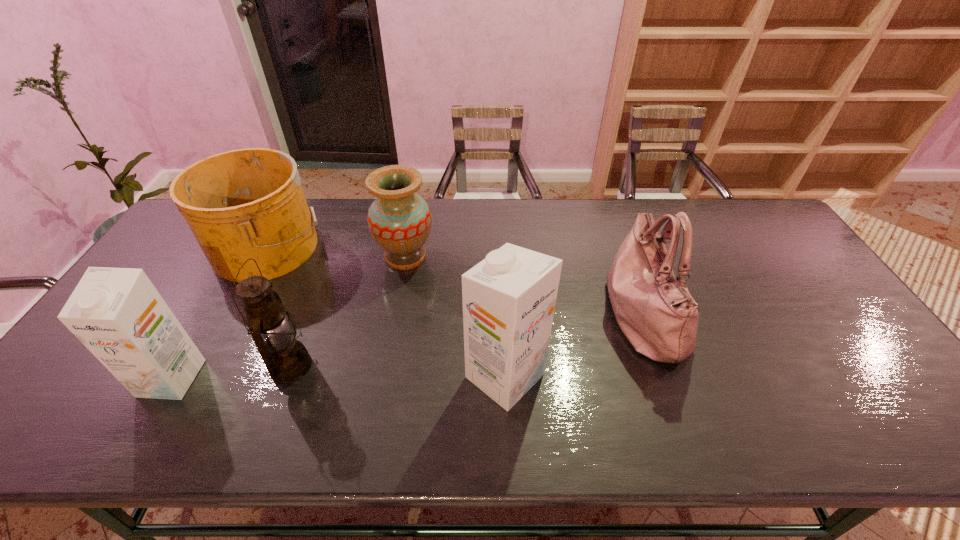
In the current image, all cartons are evenly spaced. To maintain this equal spacing, where should an additional carton be placed on the right? Please point out a free spot. Please provide its 2D coordinates. Your answer should be formatted as a tuple, i.e. [(x, y)], where the tuple contains the x and y coordinates of a point satisfying the conditions above.

[(835, 374)]